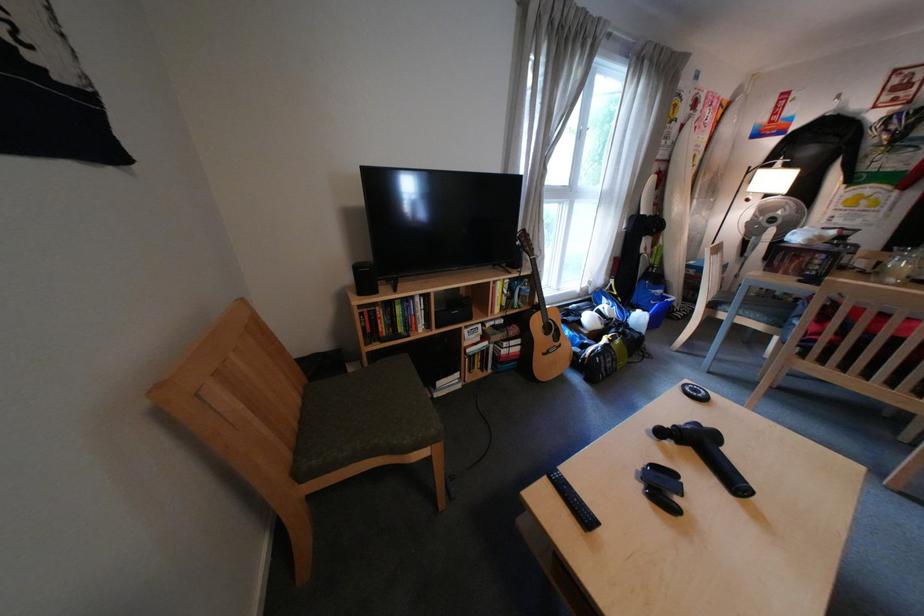
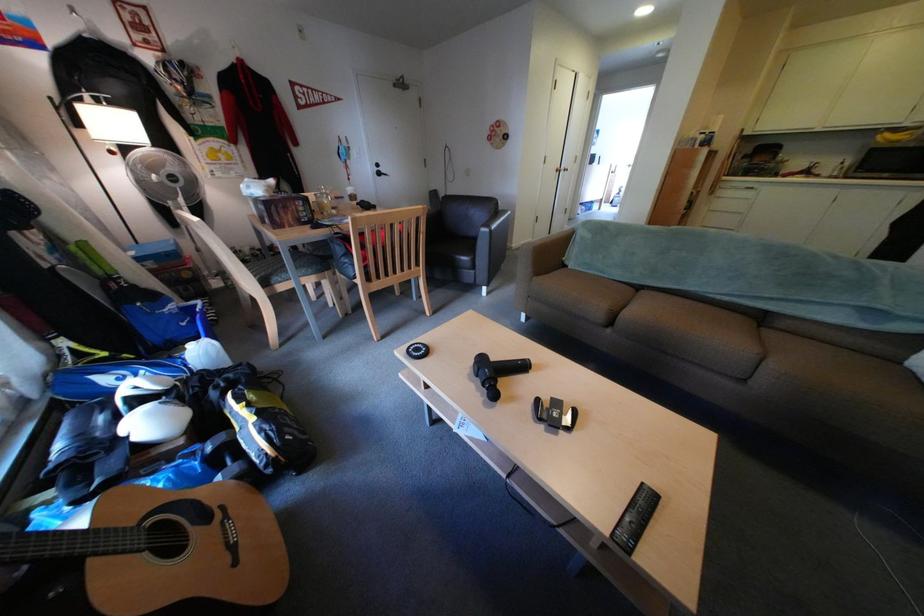
The point at [652,312] is marked in the first image. Where is the corresponding point in the second image?

(204, 347)